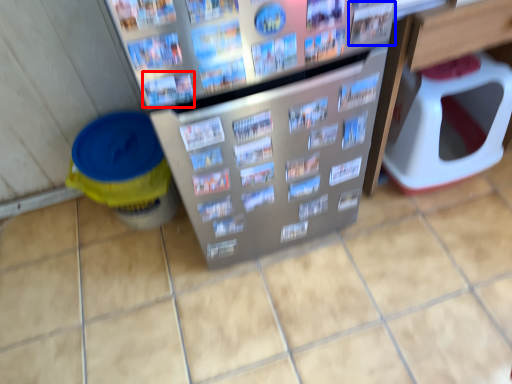
Question: Which object is further to the camera taking this photo, magazine (highlighted by a red box) or magazine (highlighted by a blue box)?

Choices:
 (A) magazine
 (B) magazine

Answer: (B)